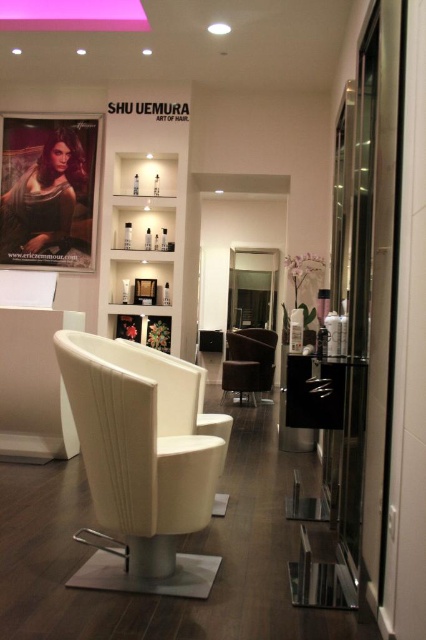
Question: Which of the following is the farthest from the observer?

Choices:
 (A) white leather swivel chair at center
 (B) matte black poster at left

Answer: (B)

Question: Can you confirm if white leather swivel chair at center is positioned to the left of velvet brown armchair at center?

Choices:
 (A) yes
 (B) no

Answer: (A)

Question: Is matte black poster at left positioned behind velvet brown armchair at center?

Choices:
 (A) yes
 (B) no

Answer: (B)

Question: Which of the following is the farthest from the observer?

Choices:
 (A) (264, 380)
 (B) (97, 440)

Answer: (A)

Question: Which point is closer to the camera taking this photo?

Choices:
 (A) (273, 358)
 (B) (137, 490)

Answer: (B)

Question: Is matte black poster at left to the left of velvet brown armchair at center from the viewer's perspective?

Choices:
 (A) no
 (B) yes

Answer: (B)